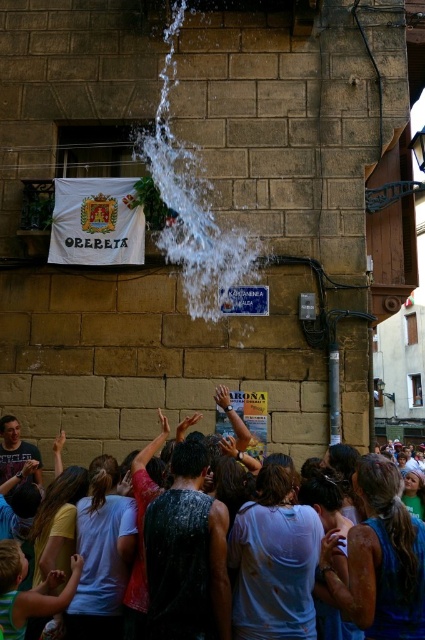
You are a photographer trying to capture the crowd and the water splash in the scene. Which object is smaller in size between the white frothy water at center and the wet skin crowd at lower center?

The white frothy water at center is smaller than the wet skin crowd at lower center according to the description.